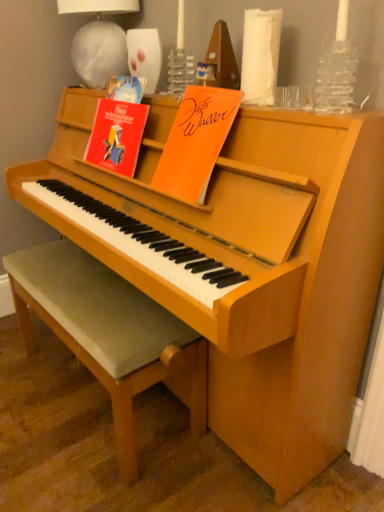
Question: Is white fabric lampshade at upper center spatially inside red paper at upper left, which is counted as the second paperback book, starting from the right, or outside of it?

Choices:
 (A) outside
 (B) inside

Answer: (A)

Question: Relative to red paper at upper left, which is counted as the second paperback book, starting from the right, is white fabric lampshade at upper center in front or behind?

Choices:
 (A) behind
 (B) front

Answer: (A)

Question: Considering the real-world distances, which object is closest to the white fabric lampshade at upper center?

Choices:
 (A) light brown wooden stool at center
 (B) orange paper at upper center, which is counted as the 2th paperback book, starting from the left
 (C) red paper at upper left, which is counted as the 1th paperback book, starting from the left

Answer: (C)

Question: Which of these objects is positioned closest to the light brown wooden stool at center?

Choices:
 (A) red paper at upper left, which is counted as the 1th paperback book, starting from the left
 (B) orange paper at upper center, which is counted as the 2th paperback book, starting from the left
 (C) white fabric lampshade at upper center

Answer: (A)